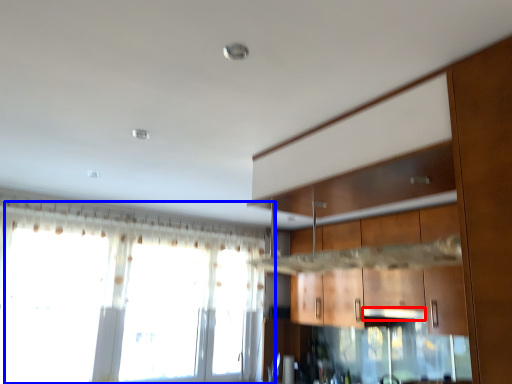
Question: Among these objects, which one is farthest to the camera, exhaust hood (highlighted by a red box) or window (highlighted by a blue box)?

Choices:
 (A) exhaust hood
 (B) window

Answer: (A)